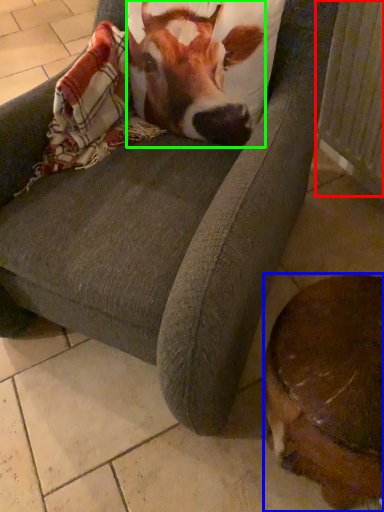
Question: Which is nearer to the radiator (highlighted by a red box)? dog (highlighted by a blue box) or cattle (highlighted by a green box).

Choices:
 (A) dog
 (B) cattle

Answer: (B)